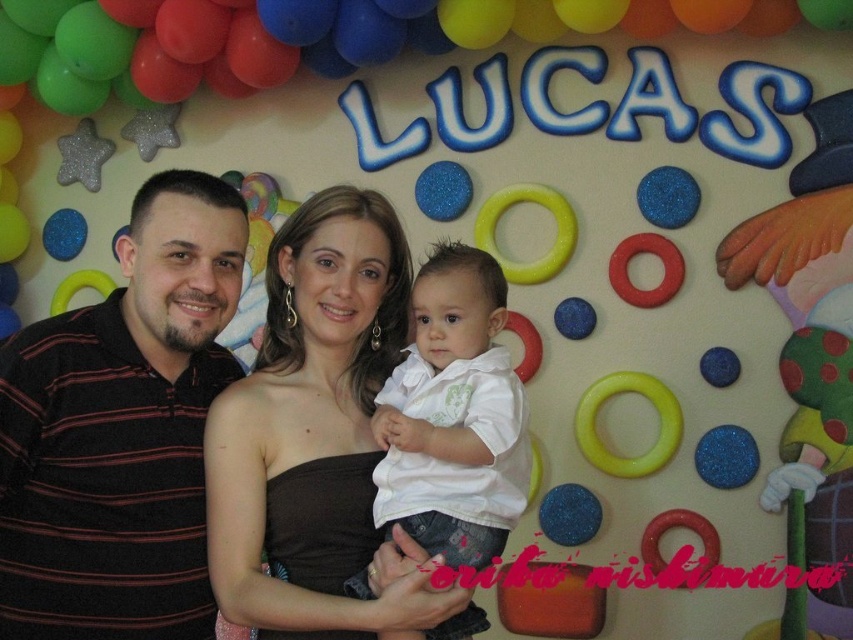
Looking at this image, you are a photographer setting up for a family photo. You need to position a small prop that is 3 inches wide between the striped polo shirt at left and the matte white dress at center. Can you fit the prop between them without overlapping either?

The striped polo shirt at left is 8.11 inches from the matte white dress at center. Since the prop is only 3 inches wide, there is enough space to place it between them without overlapping either.

You are a photographer setting up for a family photo. You need to ensure that the matte white dress at center is visible and not obscured by the green matte balloon at upper center. Based on the scene description, will the balloon block the dress?

The matte white dress at center has a lesser width compared to the green matte balloon at upper center. Since the balloon is wider, it might partially block the dress depending on their vertical positions. However, the balloon is at upper center, so it may only obscure the upper part of the dress if they are aligned horizontally.